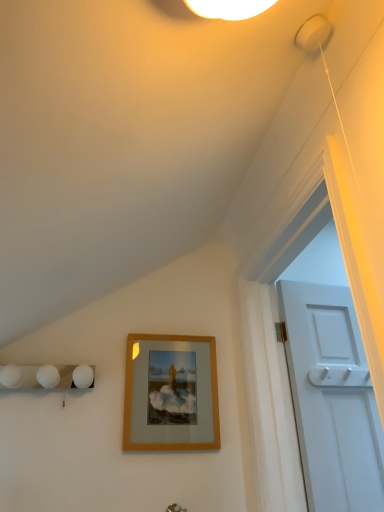
What do you see at coordinates (171, 393) in the screenshot? Image resolution: width=384 pixels, height=512 pixels. I see `wooden frame at center` at bounding box center [171, 393].

Find the location of a particular element. This screenshot has width=384, height=512. wooden frame at center is located at coordinates pos(171,393).

Locate an element on the screen. silver metallic door handle at lower center is located at coordinates (175, 508).

Describe the element at coordinates (175, 508) in the screenshot. This screenshot has width=384, height=512. I see `silver metallic door handle at lower center` at that location.

In order to face silver metallic door handle at lower center, should I rotate leftwards or rightwards?

It's best to rotate left around 1.878 degrees.

What is the approximate height of silver metallic door handle at lower center?

The height of silver metallic door handle at lower center is 2.30 inches.

The height and width of the screenshot is (512, 384). I want to click on wooden frame at center, so click(171, 393).

Considering the relative positions of silver metallic door handle at lower center and wooden frame at center in the image provided, is silver metallic door handle at lower center to the left of wooden frame at center from the viewer's perspective?

Incorrect, silver metallic door handle at lower center is not on the left side of wooden frame at center.

Who is more distant, silver metallic door handle at lower center or wooden frame at center?

wooden frame at center is behind.

Which is in front, point (177, 505) or point (159, 389)?

Point (177, 505)

From the image's perspective, would you say silver metallic door handle at lower center is shown under wooden frame at center?

Yes.

From a real-world perspective, who is located higher, silver metallic door handle at lower center or wooden frame at center?

wooden frame at center, from a real-world perspective.

Looking at their sizes, would you say silver metallic door handle at lower center is wider or thinner than wooden frame at center?

silver metallic door handle at lower center is wider than wooden frame at center.

Who is taller, silver metallic door handle at lower center or wooden frame at center?

wooden frame at center.

Based on the photo, who is smaller, silver metallic door handle at lower center or wooden frame at center?

Smaller between the two is silver metallic door handle at lower center.

Is silver metallic door handle at lower center completely or partially outside of wooden frame at center?

Yes, silver metallic door handle at lower center is located beyond the bounds of wooden frame at center.

Are silver metallic door handle at lower center and wooden frame at center making contact?

silver metallic door handle at lower center is not next to wooden frame at center, and they're not touching.

Is silver metallic door handle at lower center positioned with its back to wooden frame at center?

No.

Can you tell me how much silver metallic door handle at lower center and wooden frame at center differ in facing direction?

silver metallic door handle at lower center and wooden frame at center are facing 0.00694 degrees away from each other.

Measure the distance between silver metallic door handle at lower center and wooden frame at center.

silver metallic door handle at lower center and wooden frame at center are 14.46 inches apart from each other.

The width and height of the screenshot is (384, 512). I want to click on picture frame above the silver metallic door handle at lower center (from a real-world perspective), so click(171, 393).

Based on the photo, which is more to the left, wooden frame at center or silver metallic door handle at lower center?

Positioned to the left is wooden frame at center.

Considering the positions of objects wooden frame at center and silver metallic door handle at lower center in the image provided, who is behind, wooden frame at center or silver metallic door handle at lower center?

Positioned behind is wooden frame at center.

Is point (201, 394) closer to viewer compared to point (169, 508)?

No, it is not.

From the image's perspective, which object appears higher, wooden frame at center or silver metallic door handle at lower center?

wooden frame at center, from the image's perspective.

From a real-world perspective, is wooden frame at center physically below silver metallic door handle at lower center?

Actually, wooden frame at center is physically above silver metallic door handle at lower center in the real world.

Considering the relative sizes of wooden frame at center and silver metallic door handle at lower center in the image provided, is wooden frame at center wider than silver metallic door handle at lower center?

No.

Is wooden frame at center taller or shorter than silver metallic door handle at lower center?

Clearly, wooden frame at center is taller compared to silver metallic door handle at lower center.

Looking at the image, does wooden frame at center seem bigger or smaller compared to silver metallic door handle at lower center?

wooden frame at center is bigger than silver metallic door handle at lower center.

Which is correct: wooden frame at center is inside silver metallic door handle at lower center, or outside of it?

wooden frame at center is located beyond the bounds of silver metallic door handle at lower center.

Is wooden frame at center positioned far away from silver metallic door handle at lower center?

No, there isn't a large distance between wooden frame at center and silver metallic door handle at lower center.

Is wooden frame at center facing towards silver metallic door handle at lower center?

No, wooden frame at center is not oriented towards silver metallic door handle at lower center.

The height and width of the screenshot is (512, 384). What are the coordinates of `picture frame positioned vertically above the silver metallic door handle at lower center (from a real-world perspective)` in the screenshot? It's located at (171, 393).

Locate an element on the screen. The width and height of the screenshot is (384, 512). picture frame above the silver metallic door handle at lower center (from a real-world perspective) is located at coordinates (171, 393).

The width and height of the screenshot is (384, 512). Find the location of `picture frame above the silver metallic door handle at lower center (from the image's perspective)`. picture frame above the silver metallic door handle at lower center (from the image's perspective) is located at coordinates (171, 393).